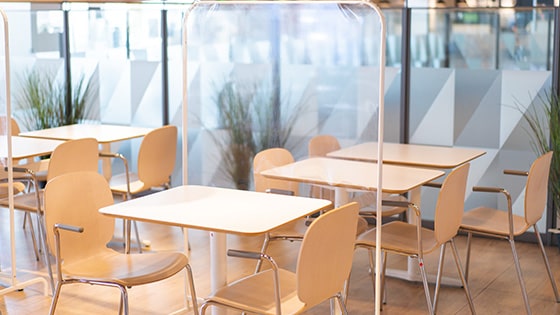
Locate an element on the screen. tabletops is located at coordinates (28, 145), (65, 129), (232, 208), (330, 176), (400, 152).